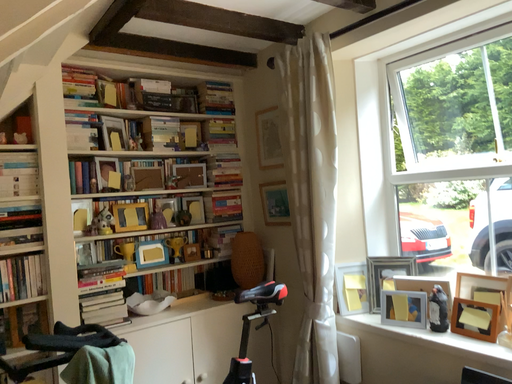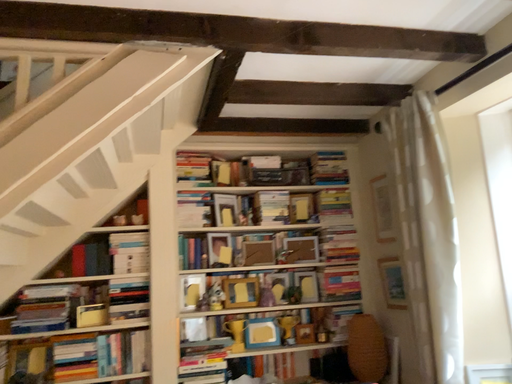
Question: Which way did the camera rotate in the video?

Choices:
 (A) rotated left
 (B) rotated right

Answer: (A)